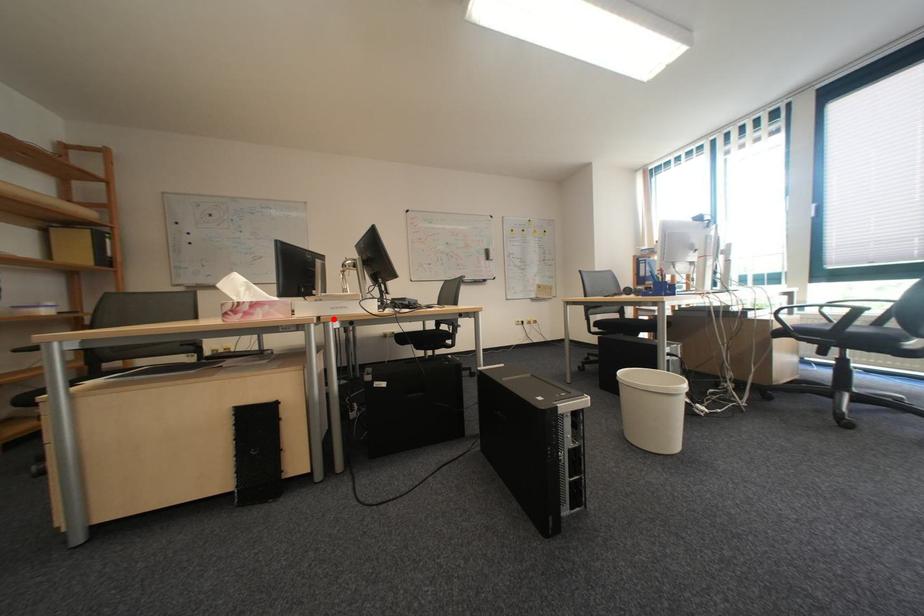
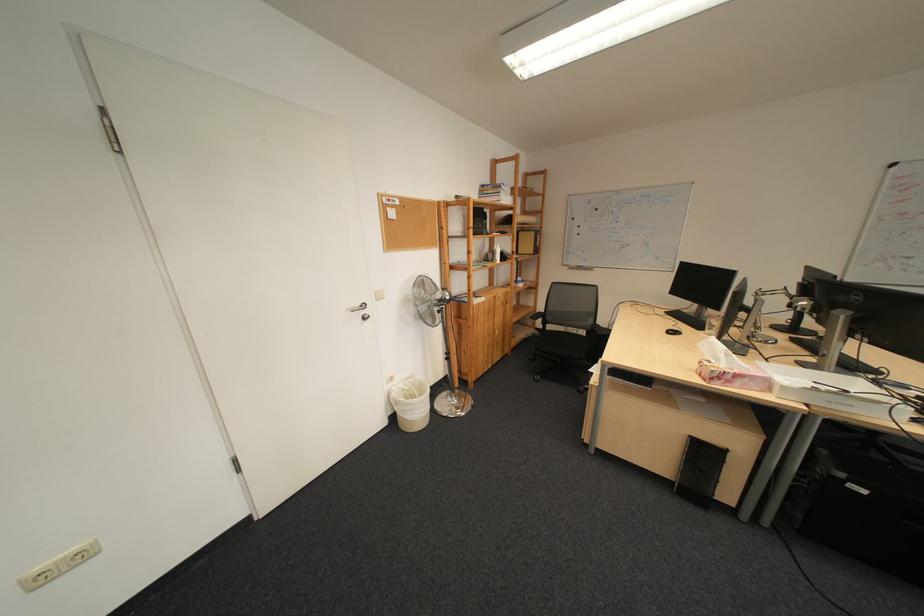
Locate, in the second image, the point that corresponds to the highlighted location in the first image.

(821, 407)